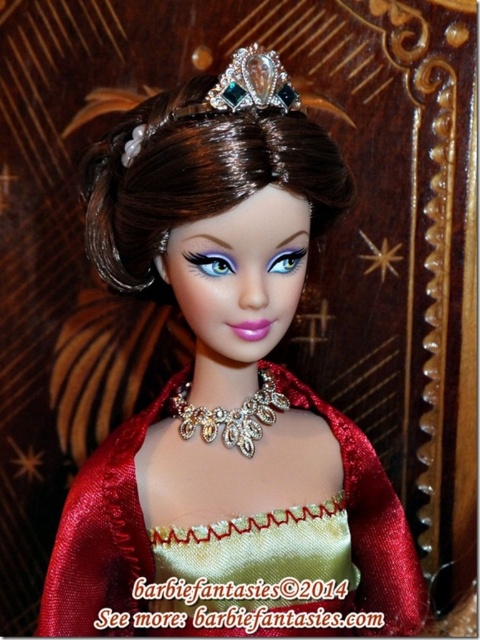
Is shiny gold fabric dress at center to the right of clear crystal tiara at center from the viewer's perspective?

Correct, you'll find shiny gold fabric dress at center to the right of clear crystal tiara at center.

Who is more forward, (x=118, y=605) or (x=203, y=97)?

Point (x=203, y=97)

Locate an element on the screen. This screenshot has height=640, width=480. shiny gold fabric dress at center is located at coordinates (101, 534).

Which is more to the left, shiny brown hair at center or shiny gold fabric dress at center?

Positioned to the left is shiny brown hair at center.

Which is in front, point (90, 204) or point (337, 428)?

Point (90, 204)

Which is behind, point (158, 214) or point (351, 465)?

The point (351, 465) is more distant.

Identify the location of shiny brown hair at center. This screenshot has height=640, width=480. (197, 177).

Is clear crystal tiara at center taller than swarovski crystal tiara at center?

Yes.

Who is taller, clear crystal tiara at center or swarovski crystal tiara at center?

With more height is clear crystal tiara at center.

What do you see at coordinates (230, 93) in the screenshot? Image resolution: width=480 pixels, height=640 pixels. I see `clear crystal tiara at center` at bounding box center [230, 93].

Where is `clear crystal tiara at center`? clear crystal tiara at center is located at coordinates (230, 93).